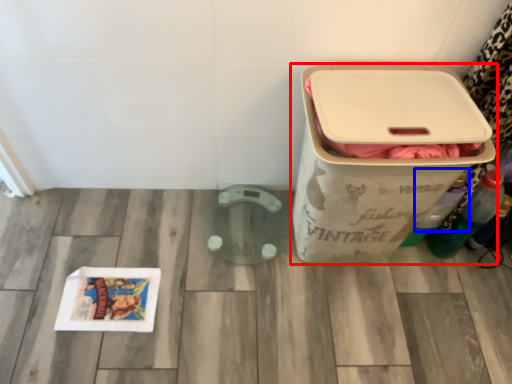
Question: Which object appears closest to the camera in this image, waste container (highlighted by a red box) or bottle (highlighted by a blue box)?

Choices:
 (A) waste container
 (B) bottle

Answer: (A)